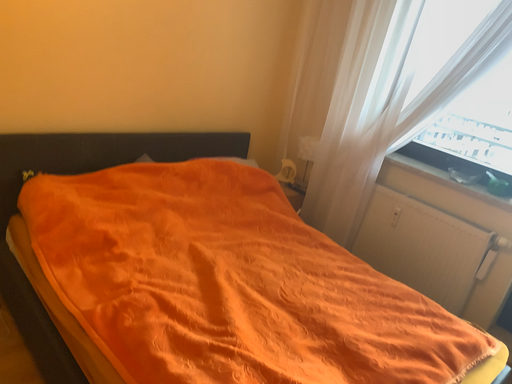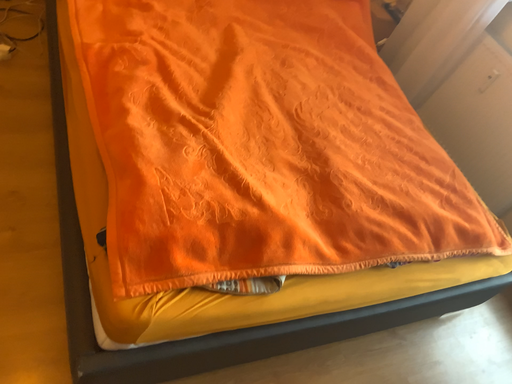
Question: Which way did the camera rotate in the video?

Choices:
 (A) rotated upward
 (B) rotated downward

Answer: (B)